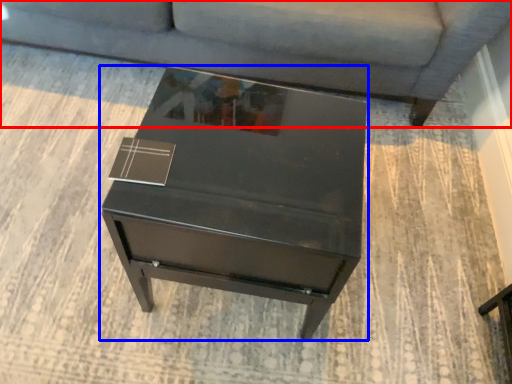
Question: Which object appears farthest to the camera in this image, studio couch (highlighted by a red box) or table (highlighted by a blue box)?

Choices:
 (A) studio couch
 (B) table

Answer: (A)